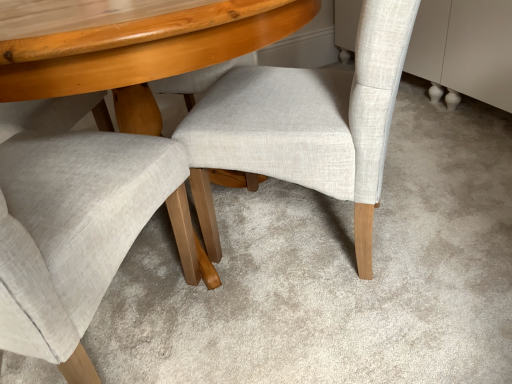
What is the approximate width of light beige fabric chair at center, which appears as the second chair when viewed from the left?

light beige fabric chair at center, which appears as the second chair when viewed from the left, is 21.92 inches in width.

What do you see at coordinates (306, 125) in the screenshot?
I see `light beige fabric chair at center, which appears as the second chair when viewed from the left` at bounding box center [306, 125].

Measure the distance between light beige fabric chair at center, marked as the first chair in a right-to-left arrangement, and camera.

light beige fabric chair at center, marked as the first chair in a right-to-left arrangement, is 29.23 inches away from camera.

How much space does light beige fabric chair at center, marked as the first chair in a right-to-left arrangement, occupy vertically?

light beige fabric chair at center, marked as the first chair in a right-to-left arrangement, is 28.22 inches tall.

This screenshot has width=512, height=384. Find the location of `light beige fabric chair at center, marked as the first chair in a right-to-left arrangement`. light beige fabric chair at center, marked as the first chair in a right-to-left arrangement is located at coordinates (306, 125).

This screenshot has width=512, height=384. What do you see at coordinates (78, 227) in the screenshot?
I see `light gray fabric chair at center, the second chair viewed from the right` at bounding box center [78, 227].

Identify the location of light gray fabric chair at center, the second chair viewed from the right. (78, 227).

Image resolution: width=512 pixels, height=384 pixels. In order to click on light beige fabric chair at center, which appears as the second chair when viewed from the left in this screenshot , I will do `click(306, 125)`.

From the picture: Considering the positions of objects light beige fabric chair at center, marked as the first chair in a right-to-left arrangement, and light gray fabric chair at center, which ranks as the 1th chair in left-to-right order, in the image provided, who is more to the left, light beige fabric chair at center, marked as the first chair in a right-to-left arrangement, or light gray fabric chair at center, which ranks as the 1th chair in left-to-right order,?

light gray fabric chair at center, which ranks as the 1th chair in left-to-right order.

Is light beige fabric chair at center, marked as the first chair in a right-to-left arrangement, behind light gray fabric chair at center, the second chair viewed from the right?

Yes, light beige fabric chair at center, marked as the first chair in a right-to-left arrangement, is behind light gray fabric chair at center, the second chair viewed from the right.

Which point is more distant from viewer, (228, 111) or (30, 269)?

The point (228, 111) is more distant.

From the image's perspective, who appears lower, light beige fabric chair at center, marked as the first chair in a right-to-left arrangement, or light gray fabric chair at center, the second chair viewed from the right?

From the image's view, light gray fabric chair at center, the second chair viewed from the right, is below.

From a real-world perspective, is light beige fabric chair at center, marked as the first chair in a right-to-left arrangement, below light gray fabric chair at center, which ranks as the 1th chair in left-to-right order?

Correct, in the physical world, light beige fabric chair at center, marked as the first chair in a right-to-left arrangement, is lower than light gray fabric chair at center, which ranks as the 1th chair in left-to-right order.

Is light beige fabric chair at center, marked as the first chair in a right-to-left arrangement, wider or thinner than light gray fabric chair at center, the second chair viewed from the right?

In the image, light beige fabric chair at center, marked as the first chair in a right-to-left arrangement, appears to be more narrow than light gray fabric chair at center, the second chair viewed from the right.

Considering the sizes of objects light beige fabric chair at center, marked as the first chair in a right-to-left arrangement, and light gray fabric chair at center, the second chair viewed from the right, in the image provided, who is taller, light beige fabric chair at center, marked as the first chair in a right-to-left arrangement, or light gray fabric chair at center, the second chair viewed from the right,?

With more height is light gray fabric chair at center, the second chair viewed from the right.

Looking at the image, does light beige fabric chair at center, marked as the first chair in a right-to-left arrangement, seem bigger or smaller compared to light gray fabric chair at center, which ranks as the 1th chair in left-to-right order?

In the image, light beige fabric chair at center, marked as the first chair in a right-to-left arrangement, appears to be smaller than light gray fabric chair at center, which ranks as the 1th chair in left-to-right order.

Is light beige fabric chair at center, marked as the first chair in a right-to-left arrangement, completely or partially outside of light gray fabric chair at center, which ranks as the 1th chair in left-to-right order?

That's correct, light beige fabric chair at center, marked as the first chair in a right-to-left arrangement, is outside of light gray fabric chair at center, which ranks as the 1th chair in left-to-right order.

Is light beige fabric chair at center, which appears as the second chair when viewed from the left, in contact with light gray fabric chair at center, which ranks as the 1th chair in left-to-right order?

No.

Is light beige fabric chair at center, which appears as the second chair when viewed from the left, looking in the opposite direction of light gray fabric chair at center, which ranks as the 1th chair in left-to-right order?

No.

Can you tell me how much light beige fabric chair at center, marked as the first chair in a right-to-left arrangement, and light gray fabric chair at center, the second chair viewed from the right, differ in facing direction?

The angle between the facing direction of light beige fabric chair at center, marked as the first chair in a right-to-left arrangement, and the facing direction of light gray fabric chair at center, the second chair viewed from the right, is 91.2 degrees.

In the image, there is a light gray fabric chair at center, the second chair viewed from the right. At what (x,y) coordinates should I click in order to perform the action: click on chair below it (from a real-world perspective). Please return your answer as a coordinate pair (x, y). The height and width of the screenshot is (384, 512). Looking at the image, I should click on (306, 125).

Can you confirm if light gray fabric chair at center, which ranks as the 1th chair in left-to-right order, is positioned to the left of light beige fabric chair at center, marked as the first chair in a right-to-left arrangement?

Yes, light gray fabric chair at center, which ranks as the 1th chair in left-to-right order, is to the left of light beige fabric chair at center, marked as the first chair in a right-to-left arrangement.

Between light gray fabric chair at center, which ranks as the 1th chair in left-to-right order, and light beige fabric chair at center, which appears as the second chair when viewed from the left, which one is positioned behind?

light beige fabric chair at center, which appears as the second chair when viewed from the left, is behind.

Does point (3, 257) appear closer or farther from the camera than point (256, 150)?

Point (3, 257) is closer to the camera than point (256, 150).

From the image's perspective, which is above, light gray fabric chair at center, the second chair viewed from the right, or light beige fabric chair at center, marked as the first chair in a right-to-left arrangement?

light beige fabric chair at center, marked as the first chair in a right-to-left arrangement, appears higher in the image.

From a real-world perspective, is light gray fabric chair at center, which ranks as the 1th chair in left-to-right order, located beneath light beige fabric chair at center, marked as the first chair in a right-to-left arrangement?

No, from a real-world perspective, light gray fabric chair at center, which ranks as the 1th chair in left-to-right order, is not under light beige fabric chair at center, marked as the first chair in a right-to-left arrangement.

Based on the photo, between light gray fabric chair at center, the second chair viewed from the right, and light beige fabric chair at center, marked as the first chair in a right-to-left arrangement, which one has smaller width?

light beige fabric chair at center, marked as the first chair in a right-to-left arrangement, is thinner.

Who is shorter, light gray fabric chair at center, which ranks as the 1th chair in left-to-right order, or light beige fabric chair at center, marked as the first chair in a right-to-left arrangement?

light beige fabric chair at center, marked as the first chair in a right-to-left arrangement, is shorter.

In terms of size, does light gray fabric chair at center, the second chair viewed from the right, appear bigger or smaller than light beige fabric chair at center, which appears as the second chair when viewed from the left?

Considering their sizes, light gray fabric chair at center, the second chair viewed from the right, takes up more space than light beige fabric chair at center, which appears as the second chair when viewed from the left.

Is light gray fabric chair at center, the second chair viewed from the right, positioned beyond the bounds of light beige fabric chair at center, which appears as the second chair when viewed from the left?

Yes, light gray fabric chair at center, the second chair viewed from the right, is outside of light beige fabric chair at center, which appears as the second chair when viewed from the left.

In the scene shown: Is light gray fabric chair at center, which ranks as the 1th chair in left-to-right order, with light beige fabric chair at center, which appears as the second chair when viewed from the left?

There is a gap between light gray fabric chair at center, which ranks as the 1th chair in left-to-right order, and light beige fabric chair at center, which appears as the second chair when viewed from the left.

Is light gray fabric chair at center, the second chair viewed from the right, looking in the opposite direction of light beige fabric chair at center, which appears as the second chair when viewed from the left?

light gray fabric chair at center, the second chair viewed from the right, does not have its back to light beige fabric chair at center, which appears as the second chair when viewed from the left.

Where is `chair located underneath the light gray fabric chair at center, the second chair viewed from the right (from a real-world perspective)`? chair located underneath the light gray fabric chair at center, the second chair viewed from the right (from a real-world perspective) is located at coordinates (306, 125).

Identify the location of chair located above the light gray fabric chair at center, the second chair viewed from the right (from the image's perspective). Image resolution: width=512 pixels, height=384 pixels. (306, 125).

The height and width of the screenshot is (384, 512). In order to click on chair on the left of light beige fabric chair at center, marked as the first chair in a right-to-left arrangement in this screenshot , I will do `click(78, 227)`.